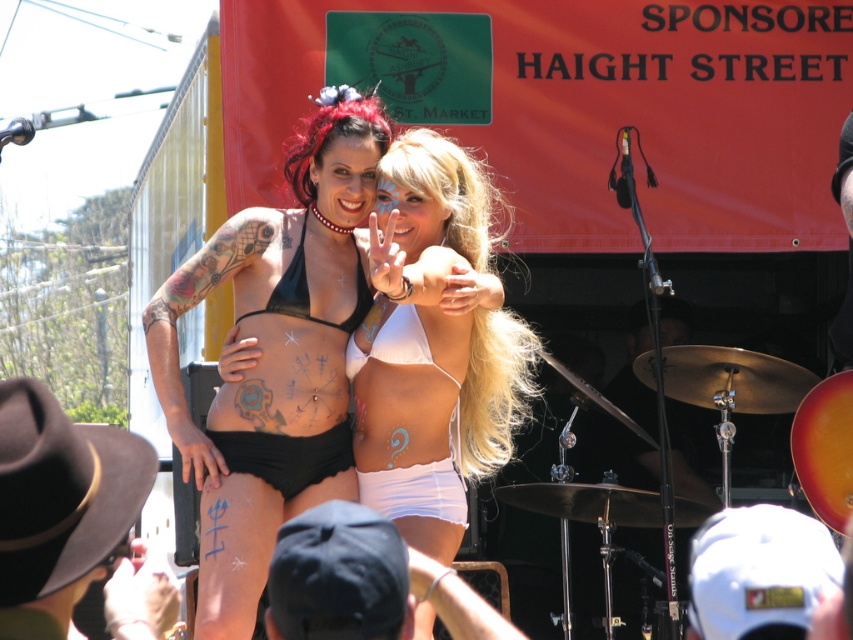
Is white fabric cap at center taller than white matte guitar at center?

Yes, white fabric cap at center is taller than white matte guitar at center.

Is white fabric cap at center positioned before white matte guitar at center?

Yes.

Does point (723, 541) come in front of point (410, 284)?

Yes, point (723, 541) is closer to viewer.

Identify the location of white fabric cap at center. (759, 572).

Between black matte bikini top at center and pearl necklace at center, which one has less height?

Standing shorter between the two is pearl necklace at center.

In the scene shown: Can you confirm if black matte bikini top at center is shorter than pearl necklace at center?

No.

Does point (328, 340) come in front of point (346, 228)?

Yes.

Identify the location of black matte bikini top at center. This screenshot has width=853, height=640. (276, 356).

At what (x,y) coordinates should I click in order to perform the action: click on pearl necklace at center. Please return your answer as a coordinate pair (x, y). The image size is (853, 640). Looking at the image, I should click on (328, 220).

Does pearl necklace at center have a smaller size compared to white matte guitar at center?

Correct, pearl necklace at center occupies less space than white matte guitar at center.

Does point (338, 227) lie behind point (383, 294)?

Yes, it is behind point (383, 294).

The width and height of the screenshot is (853, 640). Identify the location of pearl necklace at center. (328, 220).